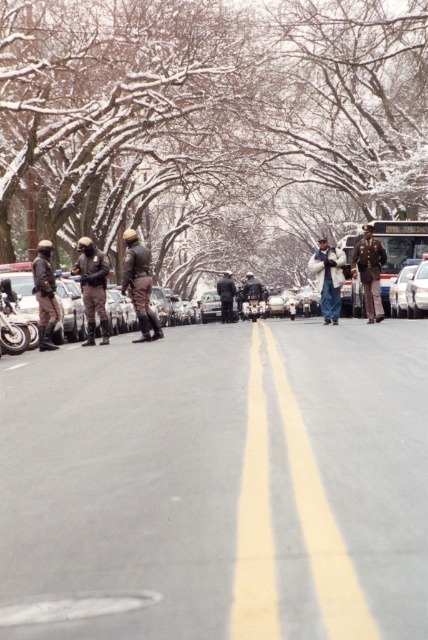
Who is shorter, shiny gold uniform at center or matte black helmet at left?

matte black helmet at left is shorter.

Between shiny gold uniform at center and matte black helmet at left, which one appears on the left side from the viewer's perspective?

Positioned to the left is matte black helmet at left.

You are a GUI agent. You are given a task and a screenshot of the screen. Output one action in this format:
    pyautogui.click(x=<x>, y=<y>)
    Task: Click on the shiny gold uniform at center
    
    Given the screenshot: What is the action you would take?
    pyautogui.click(x=369, y=272)

Is point (234, 632) positioned in front of point (231, 305)?

That is True.

Does yellow smooth road lines at center appear over dark blue uniform at center?

No.

Locate an element on the screen. The height and width of the screenshot is (640, 428). yellow smooth road lines at center is located at coordinates (255, 522).

The width and height of the screenshot is (428, 640). What do you see at coordinates (329, 278) in the screenshot?
I see `white fuzzy coat at center` at bounding box center [329, 278].

Who is more distant from viewer, (314,260) or (225,280)?

The point (225,280) is behind.

Is point (332, 294) farther from viewer compared to point (225, 298)?

No.

Locate an element on the screen. white fuzzy coat at center is located at coordinates (329, 278).